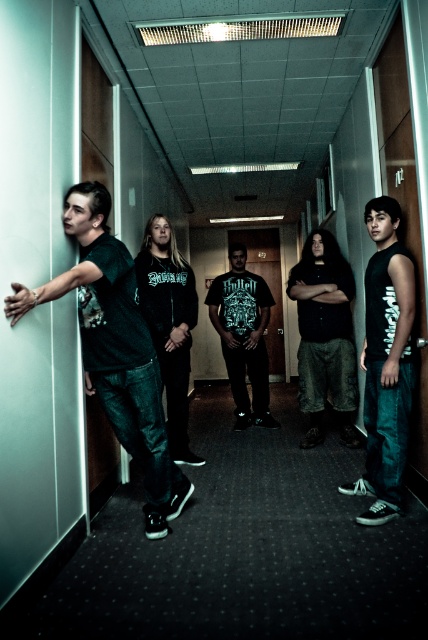
Between point (149, 376) and point (350, 285), which one is positioned in front?

Point (149, 376)

Who is positioned more to the left, dark green t-shirt at left or dark green textured pants at center?

Positioned to the left is dark green t-shirt at left.

Does point (68, 198) come behind point (297, 272)?

No, (68, 198) is closer to viewer.

This screenshot has height=640, width=428. I want to click on dark green t-shirt at left, so click(x=115, y=348).

Between black matte tank top at right and dark green hoodie at center, which one has more height?

Standing taller between the two is dark green hoodie at center.

The image size is (428, 640). Find the location of `black matte tank top at right`. black matte tank top at right is located at coordinates (386, 364).

What do you see at coordinates (386, 364) in the screenshot? I see `black matte tank top at right` at bounding box center [386, 364].

Identify the location of black matte tank top at right. (386, 364).

Is dark green textured pants at center to the right of black matte t-shirt at center from the viewer's perspective?

Indeed, dark green textured pants at center is positioned on the right side of black matte t-shirt at center.

Based on the photo, is dark green textured pants at center thinner than black matte t-shirt at center?

Indeed, dark green textured pants at center has a lesser width compared to black matte t-shirt at center.

Between point (356, 436) and point (261, 323), which one is positioned in front?

Positioned in front is point (356, 436).

Locate an element on the screen. The image size is (428, 640). dark green textured pants at center is located at coordinates (324, 337).